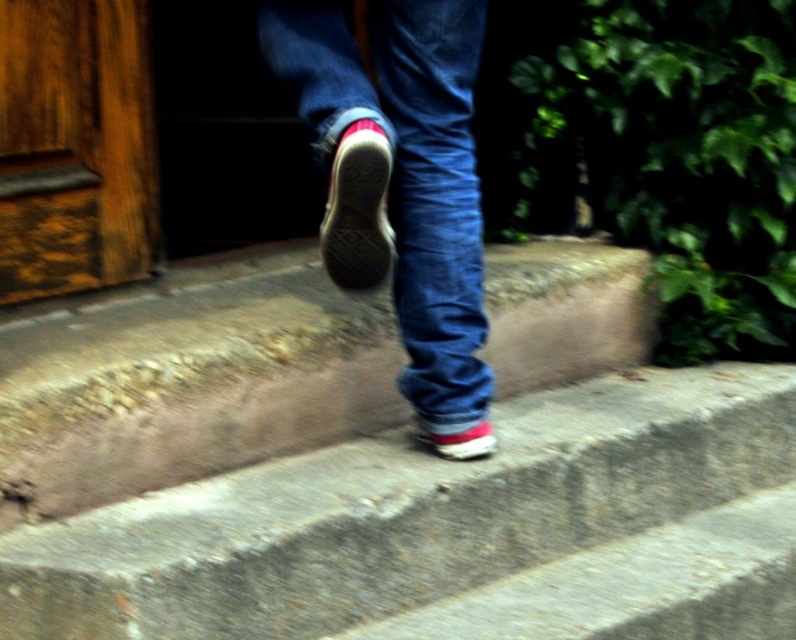
Is wooden door at upper left in front of shiny red sneaker at lower center?

No.

Which is in front, point (33, 51) or point (434, 426)?

Point (434, 426) is in front.

Identify the location of wooden door at upper left. (75, 147).

Does denim at center appear on the right side of shiny leather sneaker at center?

Correct, you'll find denim at center to the right of shiny leather sneaker at center.

Who is more forward, (478,244) or (361,225)?

Point (361,225)

Find the location of a particular element. denim at center is located at coordinates (406, 168).

At what (x,y) coordinates should I click in order to perform the action: click on wooden door at upper left. Please return your answer as a coordinate pair (x, y). This screenshot has width=796, height=640. Looking at the image, I should click on (75, 147).

Is wooden door at upper left positioned in front of shiny leather sneaker at center?

No.

This screenshot has width=796, height=640. What do you see at coordinates (75, 147) in the screenshot? I see `wooden door at upper left` at bounding box center [75, 147].

What are the coordinates of `wooden door at upper left` in the screenshot? It's located at (75, 147).